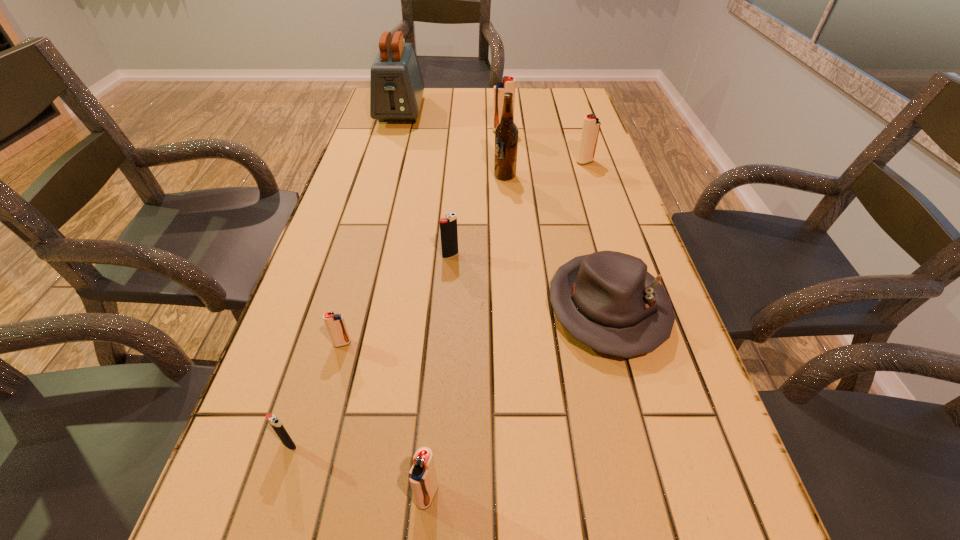
At what (x,y) coordinates should I click in order to perform the action: click on object located at the far left corner. Please return your answer as a coordinate pair (x, y). Looking at the image, I should click on (396, 85).

Find the location of a particular element. This screenshot has height=540, width=960. free region at the far edge is located at coordinates (528, 97).

Where is `vacant region at the left edge of the desktop`? The image size is (960, 540). vacant region at the left edge of the desktop is located at coordinates (355, 219).

At what (x,y) coordinates should I click in order to perform the action: click on free region at the right edge of the desktop. Please return your answer as a coordinate pair (x, y). Looking at the image, I should click on (723, 511).

At what (x,y) coordinates should I click in order to perform the action: click on vacant space at the far right corner of the desktop. Please return your answer as a coordinate pair (x, y). Looking at the image, I should click on (570, 105).

The width and height of the screenshot is (960, 540). Find the location of `empty location between the farthest red igniter and the third farthest igniter`. empty location between the farthest red igniter and the third farthest igniter is located at coordinates (476, 193).

Where is `vacant space that is in between the beer bottle and the bigger black igniter`? The width and height of the screenshot is (960, 540). vacant space that is in between the beer bottle and the bigger black igniter is located at coordinates (477, 215).

Identify the location of free area in between the beer bottle and the toaster. The image size is (960, 540). (452, 144).

Locate an element on the screen. blank region between the third red igniter from right to left and the second red igniter from right to left is located at coordinates (465, 313).

Locate an element on the screen. The height and width of the screenshot is (540, 960). empty location between the third smallest red igniter and the hat is located at coordinates (596, 235).